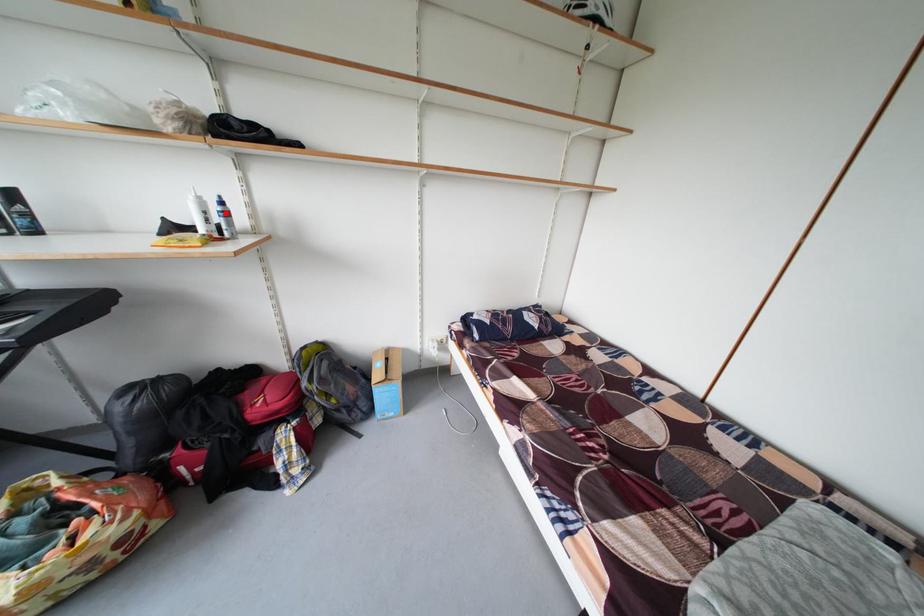
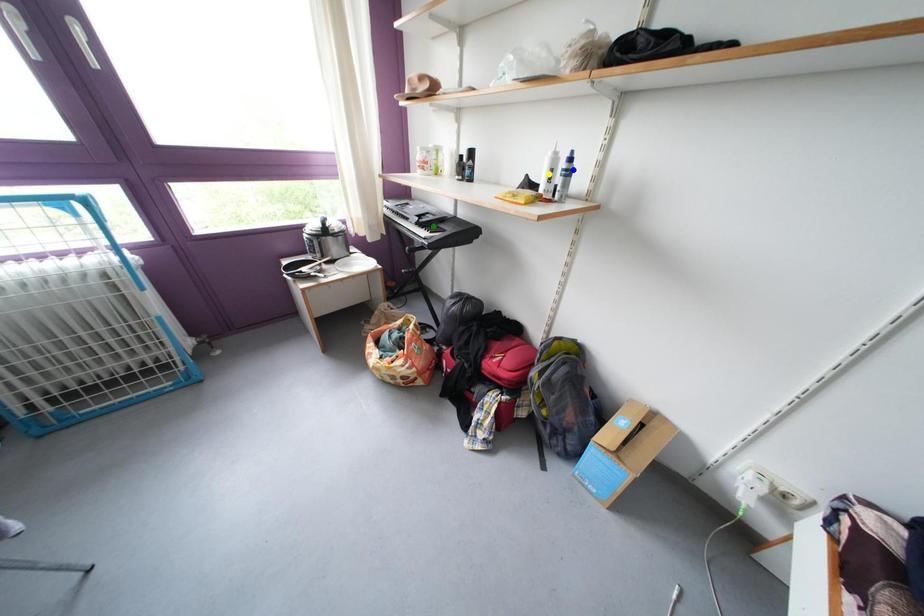
Question: I am providing you with two images of the same scene from different viewpoints. A red point is marked on the first image. You are given multiple points on the second image. Which point in image 2 is actually the same real-world point as the red point in image 1?

Choices:
 (A) blue point
 (B) yellow point
 (C) green point

Answer: (A)